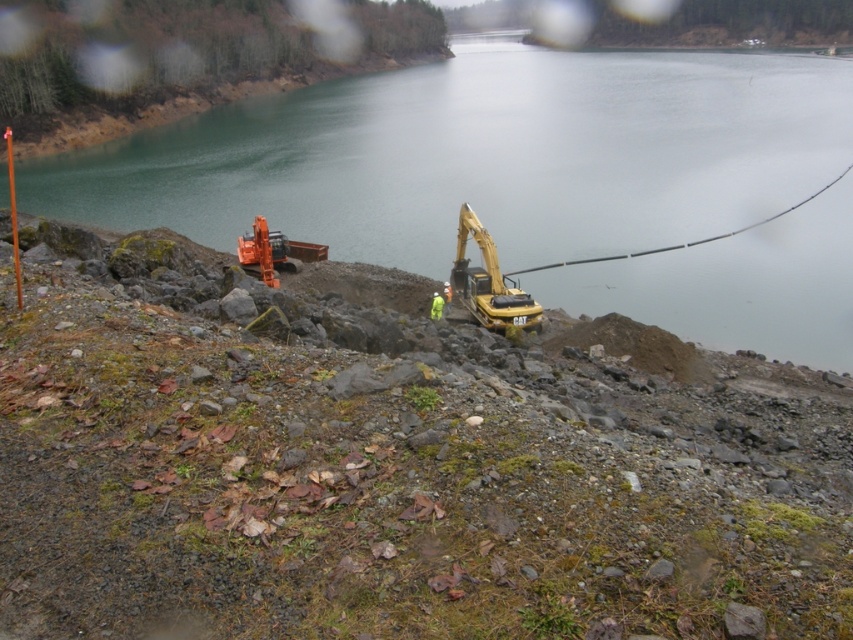
Can you confirm if greenish water at upper center is positioned to the right of orange metallic excavator at center?

Indeed, greenish water at upper center is positioned on the right side of orange metallic excavator at center.

Can you confirm if greenish water at upper center is wider than orange metallic excavator at center?

Yes, greenish water at upper center is wider than orange metallic excavator at center.

In order to click on greenish water at upper center in this screenshot , I will do `click(480, 156)`.

This screenshot has height=640, width=853. I want to click on greenish water at upper center, so click(x=480, y=156).

Does yellow metallic excavator at center appear on the left side of orange metallic excavator at center?

No, yellow metallic excavator at center is not to the left of orange metallic excavator at center.

Is yellow metallic excavator at center above orange metallic excavator at center?

No.

Locate an element on the screen. The image size is (853, 640). yellow metallic excavator at center is located at coordinates (489, 282).

Image resolution: width=853 pixels, height=640 pixels. What are the coordinates of `orange metallic excavator at center` in the screenshot? It's located at (273, 252).

Locate an element on the screen. orange metallic excavator at center is located at coordinates (273, 252).